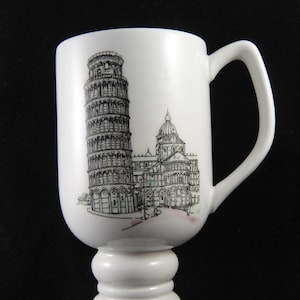
The height and width of the screenshot is (300, 300). Identify the location of mug. (198, 125).